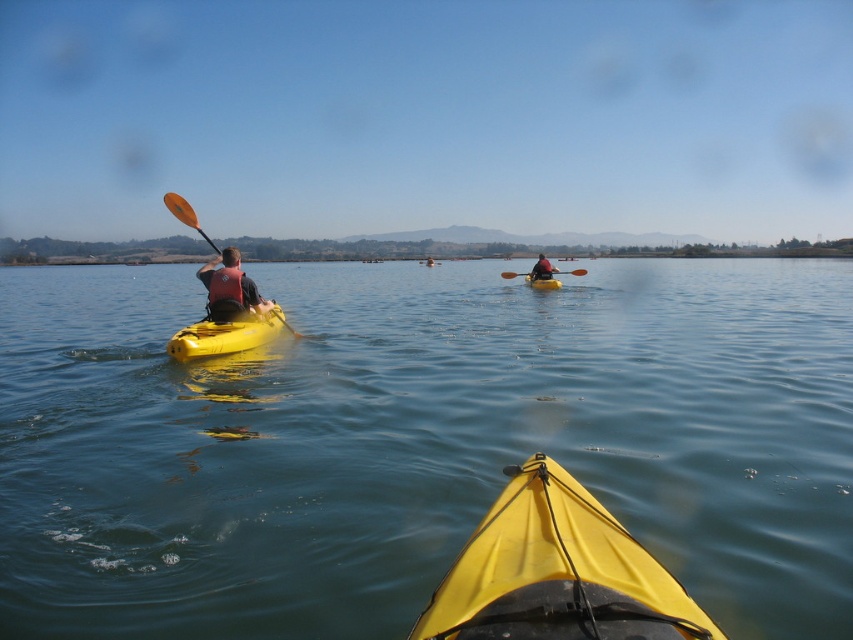
Is point (787, 378) closer to viewer compared to point (544, 285)?

Yes, point (787, 378) is closer to viewer.

Does point (828, 294) come closer to viewer compared to point (535, 288)?

That is False.

Locate an element on the screen. Image resolution: width=853 pixels, height=640 pixels. clear blue water at center is located at coordinates point(416,440).

Measure the distance between yellow matte kayak at lower center and orange paddle at center.

A distance of 27.31 meters exists between yellow matte kayak at lower center and orange paddle at center.

Can you confirm if yellow matte kayak at lower center is taller than orange paddle at center?

Yes, yellow matte kayak at lower center is taller than orange paddle at center.

Is point (538, 556) behind point (582, 272)?

No, it is in front of (582, 272).

The height and width of the screenshot is (640, 853). In order to click on yellow matte kayak at lower center in this screenshot , I will do `click(556, 572)`.

Who is more forward, (538, 420) or (178, 205)?

Point (538, 420) is in front.

Does clear blue water at center have a smaller size compared to orange paddle at left?

Incorrect, clear blue water at center is not smaller in size than orange paddle at left.

Which is behind, point (126, 412) or point (187, 205)?

Point (187, 205)

This screenshot has width=853, height=640. In order to click on clear blue water at center in this screenshot , I will do `click(416, 440)`.